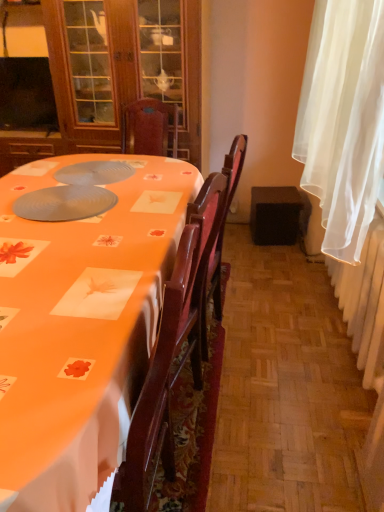
Where is `vacant area that is in front of matte gray paper plate at center`? Image resolution: width=384 pixels, height=512 pixels. vacant area that is in front of matte gray paper plate at center is located at coordinates (61, 247).